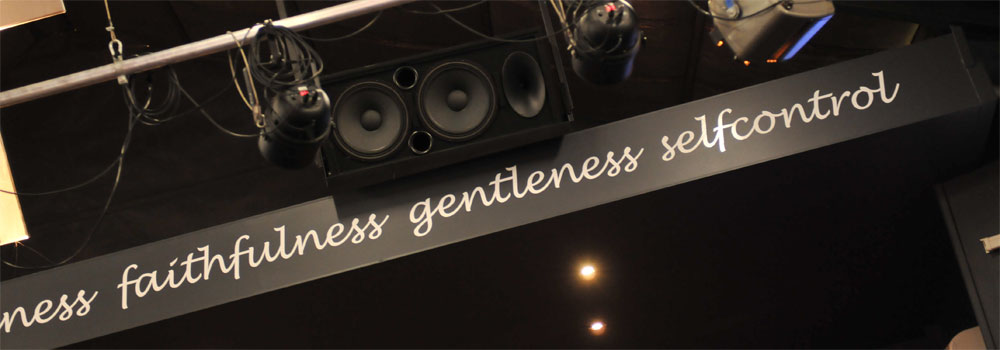
The image size is (1000, 350). I want to click on lights, so click(616, 68).